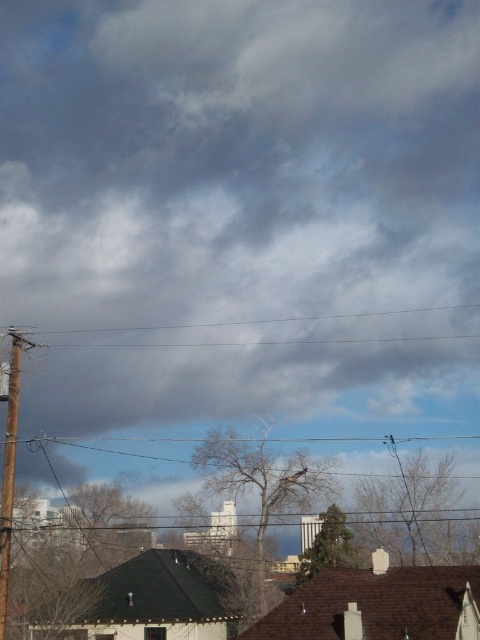
Question: Is brown wooden telegraph pole at left below wooden post at left?

Choices:
 (A) yes
 (B) no

Answer: (A)

Question: Can you confirm if brown wooden telegraph pole at left is wider than wooden post at left?

Choices:
 (A) yes
 (B) no

Answer: (A)

Question: Can you confirm if brown wooden telegraph pole at left is wider than wooden post at left?

Choices:
 (A) yes
 (B) no

Answer: (A)